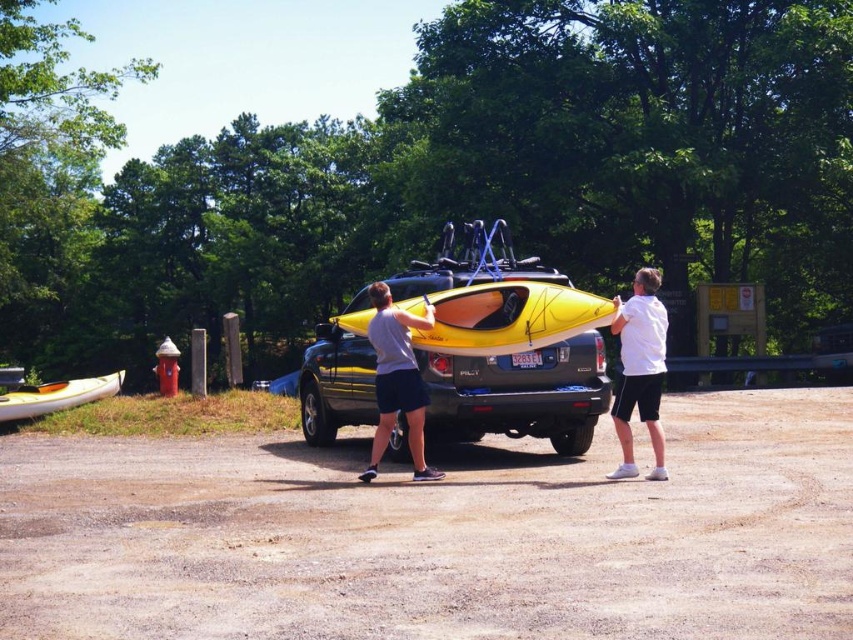
Question: Which is nearer to the white matte shirt at right?

Choices:
 (A) matte gray shorts at center
 (B) yellow matte kayak at center
 (C) white glossy canoe at lower left

Answer: (B)

Question: Is yellow matte kayak at center closer to camera compared to white matte shirt at right?

Choices:
 (A) no
 (B) yes

Answer: (A)

Question: Can you confirm if matte gray shorts at center is positioned above white glossy canoe at lower left?

Choices:
 (A) no
 (B) yes

Answer: (B)

Question: Is white matte shirt at right to the left of matte gray shorts at center from the viewer's perspective?

Choices:
 (A) yes
 (B) no

Answer: (B)

Question: Which object is closer to the camera taking this photo?

Choices:
 (A) white glossy canoe at lower left
 (B) white matte shirt at right
 (C) matte gray shorts at center

Answer: (B)

Question: Which object is positioned closest to the white matte shirt at right?

Choices:
 (A) matte gray shorts at center
 (B) yellow matte kayak at center
 (C) white glossy canoe at lower left

Answer: (B)